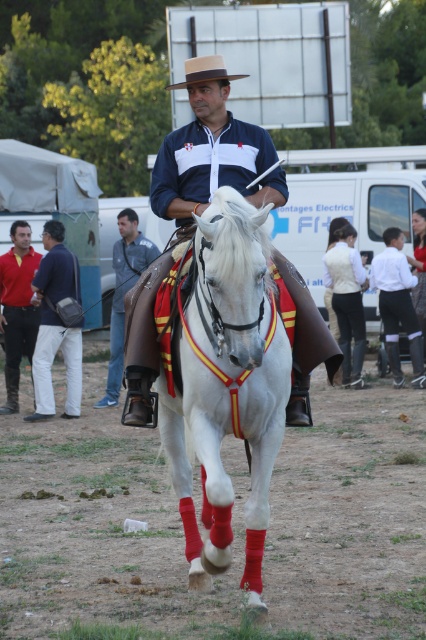
You are a photographer at the equestrian event. You want to take a photo of the dirt field at center and the red shirt at left. Which object should be placed in the foreground to ensure the background remains in focus?

The dirt field at center should be placed in the foreground because it is wider than the red shirt at left, allowing the background elements to stay sharp in the photo.

You are a photographer trying to capture a photo of the white glossy horse at center and the red shirt at left. Based on their heights, which one should you focus on first if you want to ensure both are in frame without adjusting your camera angle?

The white glossy horse at center has a lesser height compared to the red shirt at left, so you should focus on the taller red shirt at left first to ensure both are in frame without adjusting your camera angle.